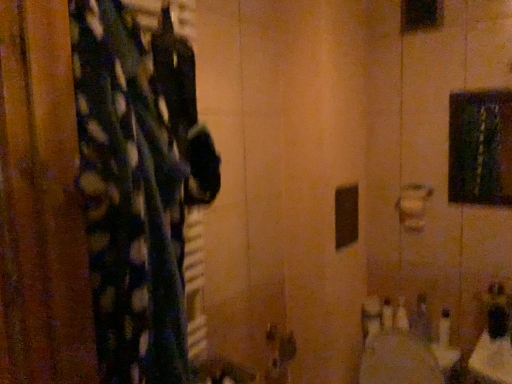
Question: Is fluffy polka dot fabric at left beside white plastic bottles at lower right, the second toiletry viewed from the right?

Choices:
 (A) no
 (B) yes

Answer: (A)

Question: Is fluffy polka dot fabric at left at the left side of white plastic bottles at lower right, marked as the 1th toiletry in a left-to-right arrangement?

Choices:
 (A) no
 (B) yes

Answer: (B)

Question: Is white plastic bottles at lower right, marked as the 1th toiletry in a left-to-right arrangement, surrounded by fluffy polka dot fabric at left?

Choices:
 (A) no
 (B) yes

Answer: (A)

Question: Is fluffy polka dot fabric at left oriented towards white plastic bottles at lower right, marked as the 1th toiletry in a left-to-right arrangement?

Choices:
 (A) yes
 (B) no

Answer: (A)

Question: Does fluffy polka dot fabric at left have a lesser width compared to white plastic bottles at lower right, marked as the 1th toiletry in a left-to-right arrangement?

Choices:
 (A) no
 (B) yes

Answer: (A)

Question: From a real-world perspective, is fluffy polka dot fabric at left located beneath white plastic bottles at lower right, marked as the 1th toiletry in a left-to-right arrangement?

Choices:
 (A) yes
 (B) no

Answer: (B)

Question: Considering the relative sizes of white plastic bottles at lower right, marked as the 1th toiletry in a left-to-right arrangement, and fluffy polka dot fabric at left in the image provided, is white plastic bottles at lower right, marked as the 1th toiletry in a left-to-right arrangement, shorter than fluffy polka dot fabric at left?

Choices:
 (A) no
 (B) yes

Answer: (B)

Question: Is white plastic bottles at lower right, marked as the 1th toiletry in a left-to-right arrangement, oriented towards fluffy polka dot fabric at left?

Choices:
 (A) no
 (B) yes

Answer: (A)

Question: Is white plastic bottles at lower right, marked as the 1th toiletry in a left-to-right arrangement, completely or partially outside of fluffy polka dot fabric at left?

Choices:
 (A) no
 (B) yes

Answer: (B)

Question: From the image's perspective, is white plastic bottles at lower right, the second toiletry viewed from the right, located beneath fluffy polka dot fabric at left?

Choices:
 (A) no
 (B) yes

Answer: (B)

Question: Is fluffy polka dot fabric at left at the back of white plastic bottles at lower right, the second toiletry viewed from the right?

Choices:
 (A) yes
 (B) no

Answer: (B)

Question: Can you confirm if white plastic bottles at lower right, marked as the 1th toiletry in a left-to-right arrangement, is smaller than fluffy polka dot fabric at left?

Choices:
 (A) yes
 (B) no

Answer: (A)

Question: Is metallic silver soap at lower right, which appears as the 1th toiletry when viewed from the right, looking in the opposite direction of white plastic bottles at lower right, marked as the 1th toiletry in a left-to-right arrangement?

Choices:
 (A) no
 (B) yes

Answer: (A)